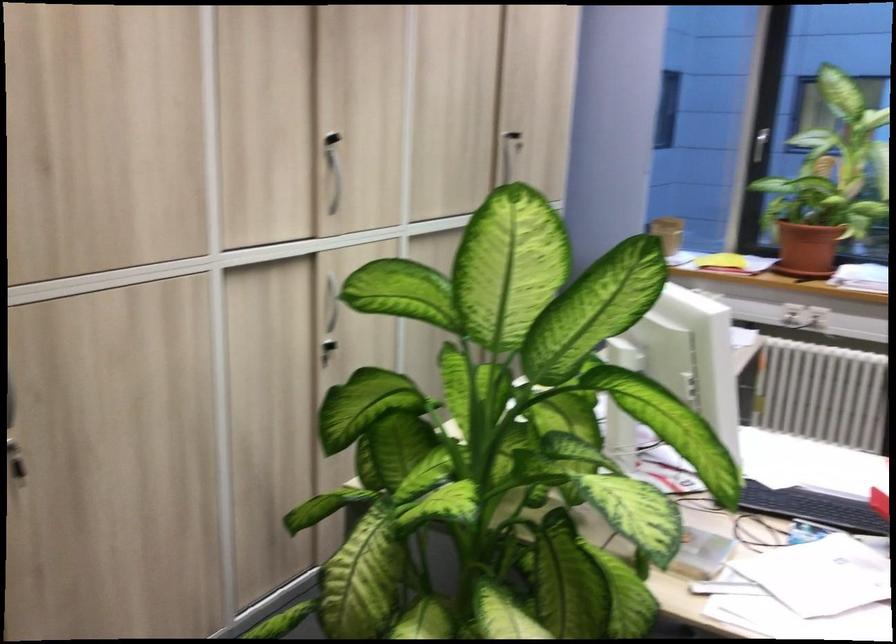
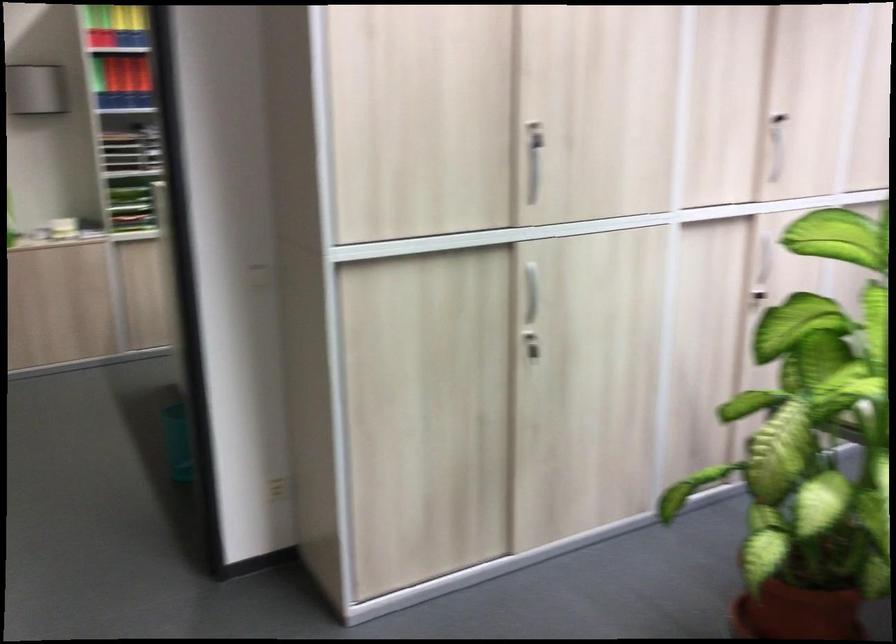
Question: The images are taken continuously from a first-person perspective. In which direction are you moving?

Choices:
 (A) Left
 (B) Right
 (C) Forward
 (D) Backward

Answer: (D)